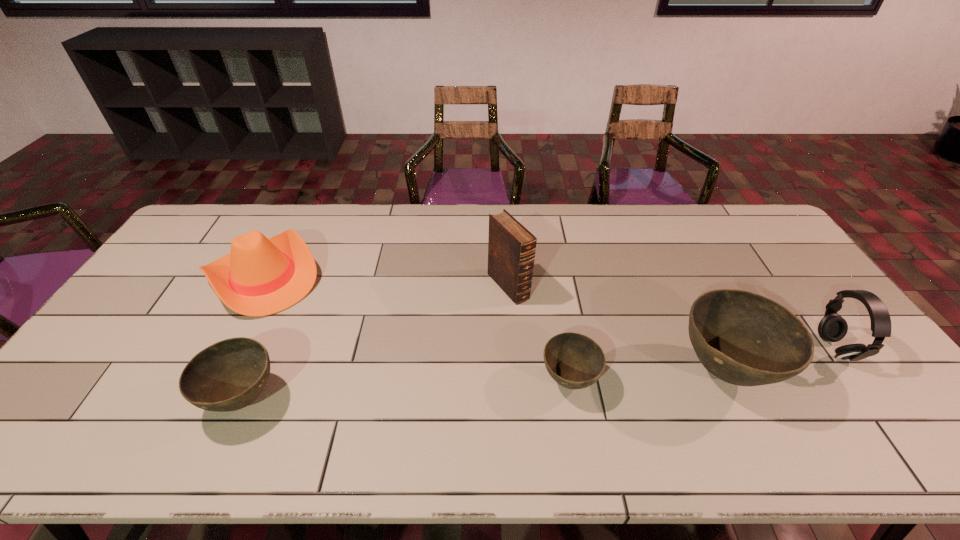
If we want them evenly spaced by inserting an extra bowl among them, please locate a free spot for this new bowl. Please provide its 2D coordinates. Your answer should be formatted as a tuple, i.e. [(x, y)], where the tuple contains the x and y coordinates of a point satisfying the conditions above.

[(410, 389)]